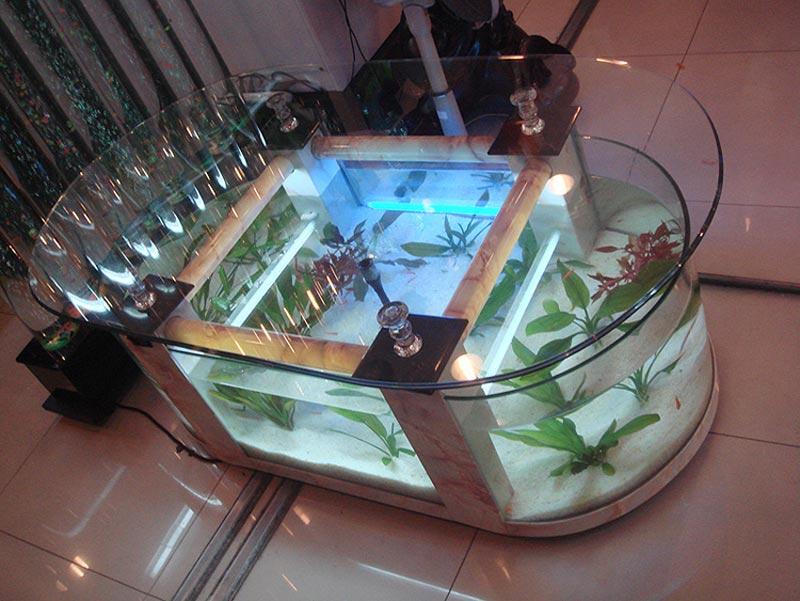
I want to click on white tile floor, so click(x=752, y=25).